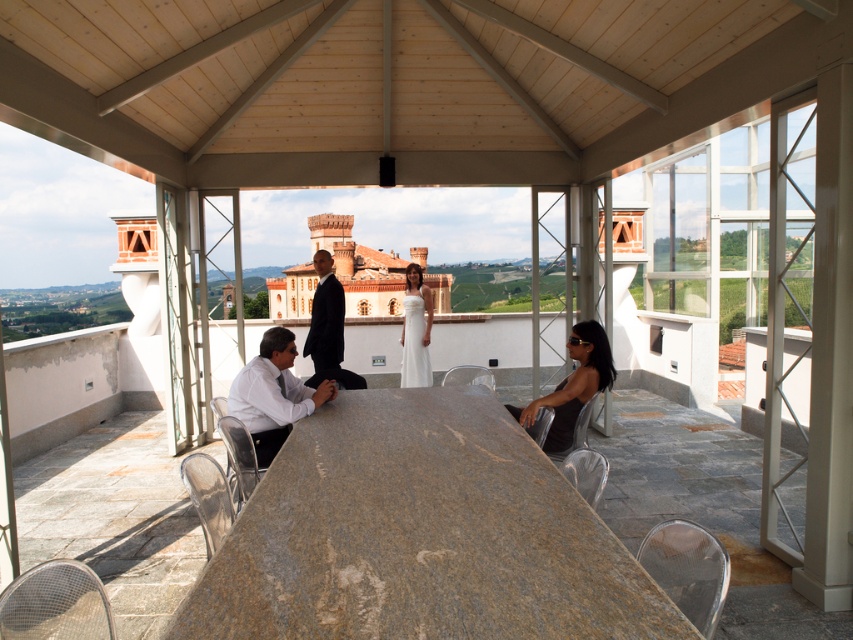
Question: Considering the real-world distances, which object is closest to the black suit at center?

Choices:
 (A) brown stone table at center
 (B) shiny silver dress at lower right
 (C) white satin dress at center
 (D) white glossy shirt at lower left

Answer: (D)

Question: From the image, what is the correct spatial relationship of white glossy shirt at lower left in relation to shiny silver dress at lower right?

Choices:
 (A) below
 (B) above

Answer: (A)

Question: Is brown stone table at center further to the viewer compared to black suit at center?

Choices:
 (A) no
 (B) yes

Answer: (A)

Question: Is the position of white glossy shirt at lower left more distant than that of shiny silver dress at lower right?

Choices:
 (A) no
 (B) yes

Answer: (A)

Question: Which of these objects is positioned farthest from the shiny silver dress at lower right?

Choices:
 (A) white satin dress at center
 (B) white glossy shirt at lower left

Answer: (A)

Question: Among these objects, which one is nearest to the camera?

Choices:
 (A) brown stone table at center
 (B) white glossy shirt at lower left

Answer: (A)